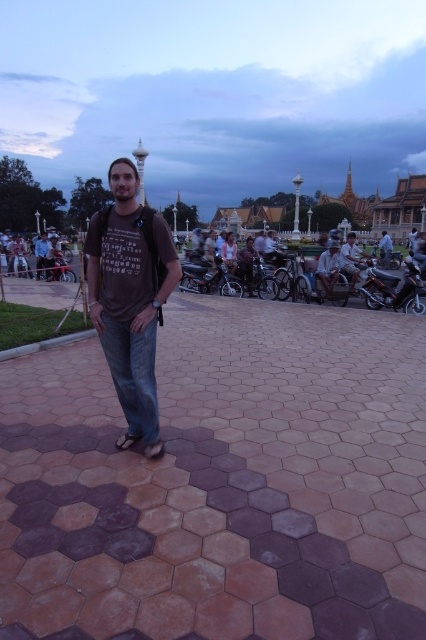
Question: Which object is farther from the camera taking this photo?

Choices:
 (A) metallic silver motorcycle at left
 (B) blue denim jeans at center
 (C) shiny metallic motorcycle at right

Answer: (B)

Question: Can you confirm if metallic silver motorcycle at left is smaller than blue denim jeans at center?

Choices:
 (A) yes
 (B) no

Answer: (A)

Question: Does brown hexagonal tiles at center appear on the right side of light brown leather jacket at right?

Choices:
 (A) no
 (B) yes

Answer: (A)

Question: Is metallic silver motorcycle at center further to camera compared to light brown leather jacket at right?

Choices:
 (A) no
 (B) yes

Answer: (B)

Question: Considering the real-world distances, which object is farthest from the matte brown t-shirt at center?

Choices:
 (A) metallic silver motorcycle at center
 (B) brown hexagonal tiles at center

Answer: (A)

Question: Which of the following is the farthest from the observer?

Choices:
 (A) matte brown t-shirt at center
 (B) shiny metallic motorcycle at right
 (C) metallic silver motorcycle at center
 (D) metallic silver motorcycle at left

Answer: (D)